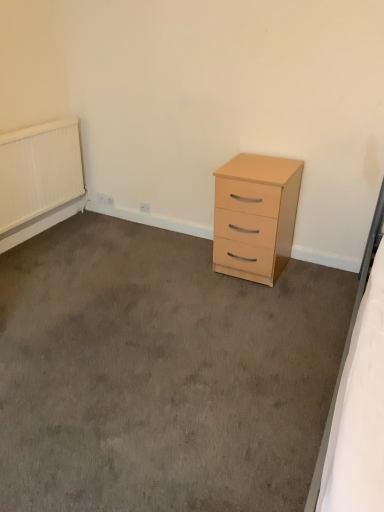
Question: Is point (264, 194) closer or farther from the camera than point (6, 166)?

Choices:
 (A) closer
 (B) farther

Answer: (A)

Question: Considering the positions of light wood/finish chest of drawers at center-right and white textured radiator at upper left in the image, is light wood/finish chest of drawers at center-right taller or shorter than white textured radiator at upper left?

Choices:
 (A) short
 (B) tall

Answer: (B)

Question: Considering their positions, is light wood/finish chest of drawers at center-right located in front of or behind white textured radiator at upper left?

Choices:
 (A) behind
 (B) front

Answer: (B)

Question: Based on their sizes in the image, would you say white textured radiator at upper left is bigger or smaller than light wood/finish chest of drawers at center-right?

Choices:
 (A) big
 (B) small

Answer: (B)

Question: Is white textured radiator at upper left situated inside light wood/finish chest of drawers at center-right or outside?

Choices:
 (A) inside
 (B) outside

Answer: (B)

Question: In terms of width, does white textured radiator at upper left look wider or thinner when compared to light wood/finish chest of drawers at center-right?

Choices:
 (A) wide
 (B) thin

Answer: (B)

Question: In the image, is white textured radiator at upper left positioned in front of or behind light wood/finish chest of drawers at center-right?

Choices:
 (A) front
 (B) behind

Answer: (B)